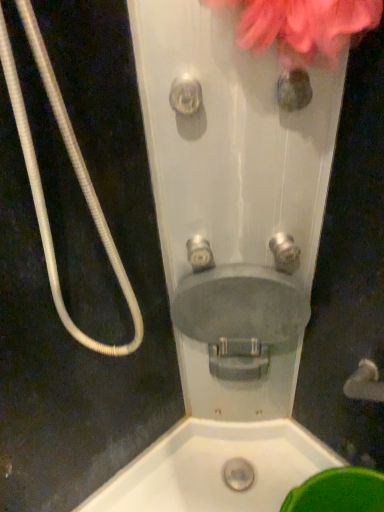
Question: Can you confirm if brushed metal faucet at center, the 2th plumbing fixture from the left, is positioned to the right of matte gray sink at center?

Choices:
 (A) yes
 (B) no

Answer: (A)

Question: Does brushed metal faucet at center, which ranks as the 1th plumbing fixture in right-to-left order, come in front of matte gray sink at center?

Choices:
 (A) no
 (B) yes

Answer: (B)

Question: Is matte gray sink at center inside brushed metal faucet at center, which ranks as the 1th plumbing fixture in right-to-left order?

Choices:
 (A) no
 (B) yes

Answer: (A)

Question: Does brushed metal faucet at center, the 2th plumbing fixture from the left, have a lesser width compared to matte gray sink at center?

Choices:
 (A) yes
 (B) no

Answer: (A)

Question: From the image's perspective, would you say brushed metal faucet at center, the 2th plumbing fixture from the left, is positioned over matte gray sink at center?

Choices:
 (A) yes
 (B) no

Answer: (A)

Question: Considering the positions of matte gray sink at center and pink fluffy flower at upper right in the image, is matte gray sink at center taller or shorter than pink fluffy flower at upper right?

Choices:
 (A) short
 (B) tall

Answer: (B)

Question: From a real-world perspective, relative to pink fluffy flower at upper right, is matte gray sink at center vertically above or below?

Choices:
 (A) above
 (B) below

Answer: (B)

Question: Is matte gray sink at center situated inside pink fluffy flower at upper right or outside?

Choices:
 (A) inside
 (B) outside

Answer: (B)

Question: Is matte gray sink at center in front of or behind pink fluffy flower at upper right in the image?

Choices:
 (A) behind
 (B) front

Answer: (A)

Question: From the image's perspective, is brushed metal faucet at center, the 2th plumbing fixture from the left, above or below clear plastic showerhead at center?

Choices:
 (A) below
 (B) above

Answer: (A)

Question: Do you think brushed metal faucet at center, which ranks as the 1th plumbing fixture in right-to-left order, is within clear plastic showerhead at center, or outside of it?

Choices:
 (A) inside
 (B) outside

Answer: (B)

Question: Looking at their shapes, would you say brushed metal faucet at center, which ranks as the 1th plumbing fixture in right-to-left order, is wider or thinner than clear plastic showerhead at center?

Choices:
 (A) thin
 (B) wide

Answer: (B)

Question: From a real-world perspective, relative to clear plastic showerhead at center, is brushed metal faucet at center, the 2th plumbing fixture from the left, vertically above or below?

Choices:
 (A) above
 (B) below

Answer: (B)

Question: Based on their sizes in the image, would you say clear plastic showerhead at center is bigger or smaller than white corrugated hose at left?

Choices:
 (A) small
 (B) big

Answer: (A)

Question: Choose the correct answer: Is clear plastic showerhead at center inside white corrugated hose at left or outside it?

Choices:
 (A) outside
 (B) inside

Answer: (A)